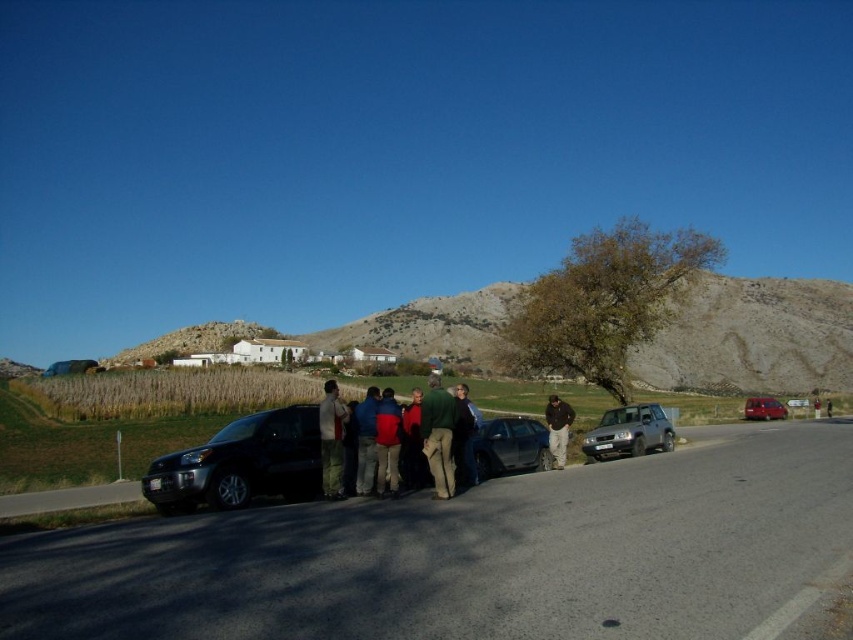
Question: Does metallic blue sedan at center appear over metallic red car at right?

Choices:
 (A) no
 (B) yes

Answer: (B)

Question: Which point appears farthest from the camera in this image?

Choices:
 (A) (381, 440)
 (B) (431, 413)

Answer: (A)

Question: Estimate the real-world distances between objects in this image. Which object is farther from the green wool sweater at center?

Choices:
 (A) satin silver suv at right
 (B) red fabric jacket at center
 (C) metallic red car at right

Answer: (C)

Question: Does blue fabric jacket at center come behind brown leather jacket at center?

Choices:
 (A) no
 (B) yes

Answer: (A)

Question: Based on their relative distances, which object is farther from the dark green fabric jacket at center?

Choices:
 (A) dark green jacket at center
 (B) satin black suv at lower left

Answer: (B)

Question: Is green corduroy pants at center positioned before red fabric jacket at center?

Choices:
 (A) no
 (B) yes

Answer: (B)